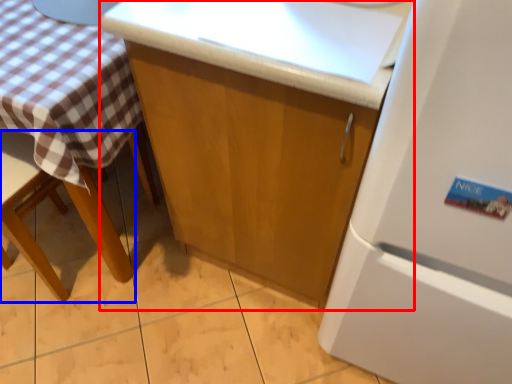
Question: Which of the following is the closest to the observer, cabinetry (highlighted by a red box) or chair (highlighted by a blue box)?

Choices:
 (A) cabinetry
 (B) chair

Answer: (A)